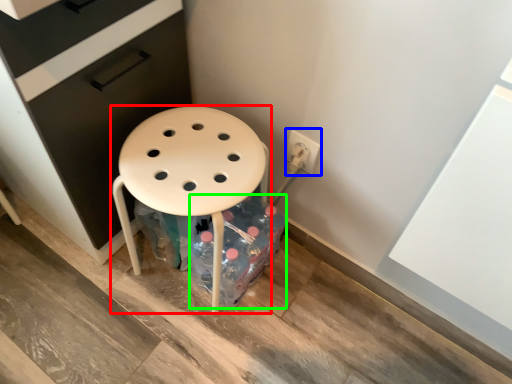
Question: Based on their relative distances, which object is nearer to stool (highlighted by a red box)? Choose from electric outlet (highlighted by a blue box) and bottle (highlighted by a green box).

Choices:
 (A) electric outlet
 (B) bottle

Answer: (B)